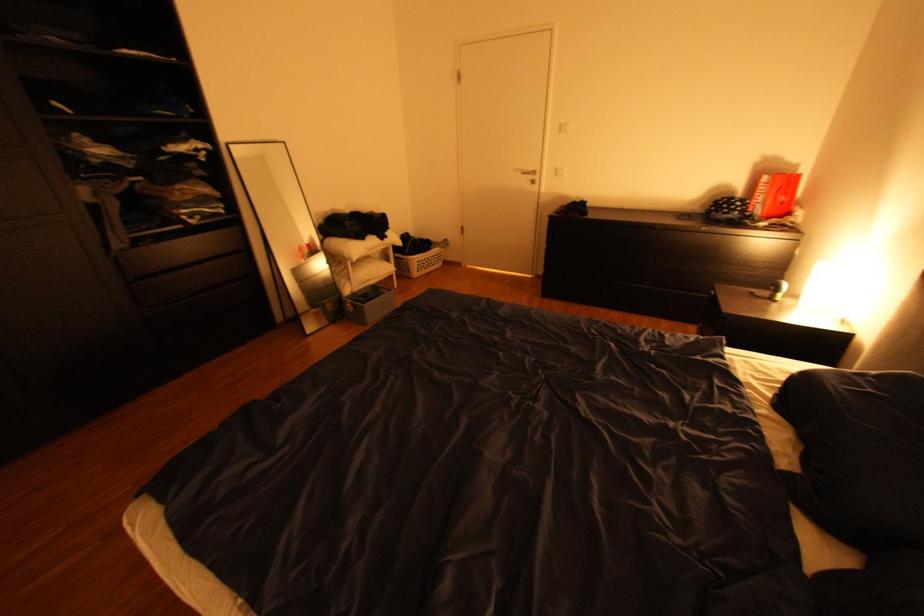
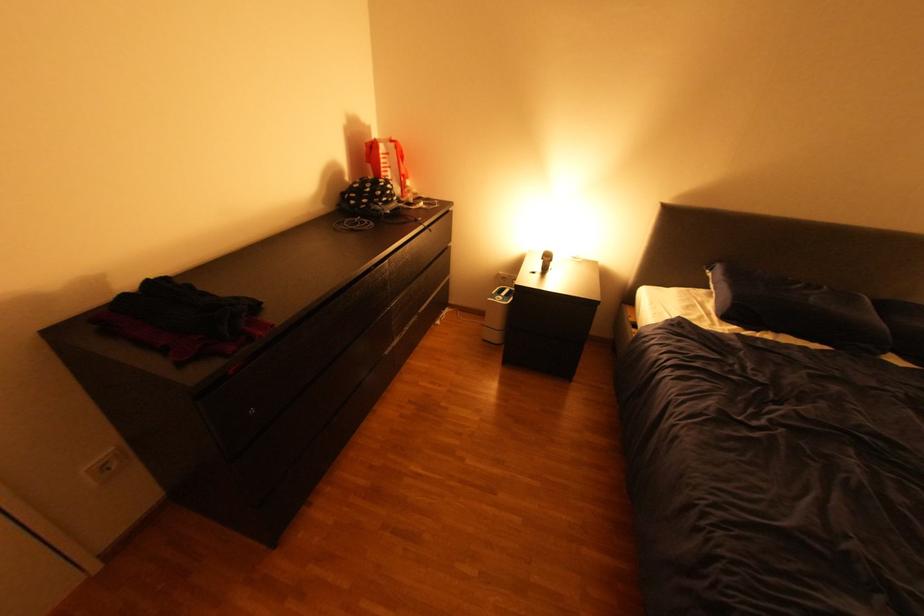
Where in the second image is the point corresponding to (788,294) from the first image?

(561, 262)